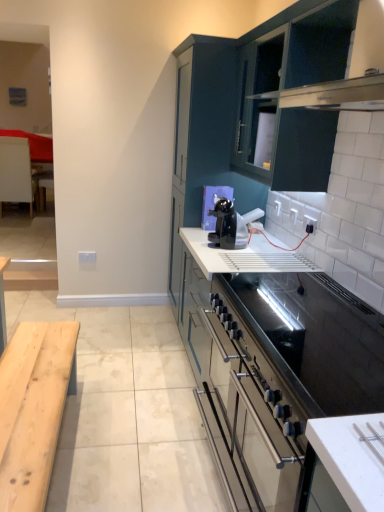
Locate an element on the screen. vacant space to the right of black glossy coffee machine at center is located at coordinates (258, 245).